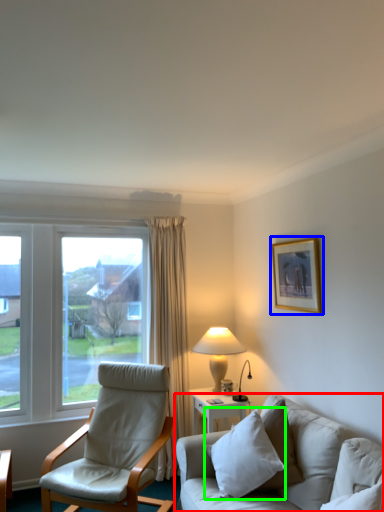
Question: Which object is positioned closest to studio couch (highlighted by a red box)? Select from picture frame (highlighted by a blue box) and pillow (highlighted by a green box).

Choices:
 (A) picture frame
 (B) pillow

Answer: (B)